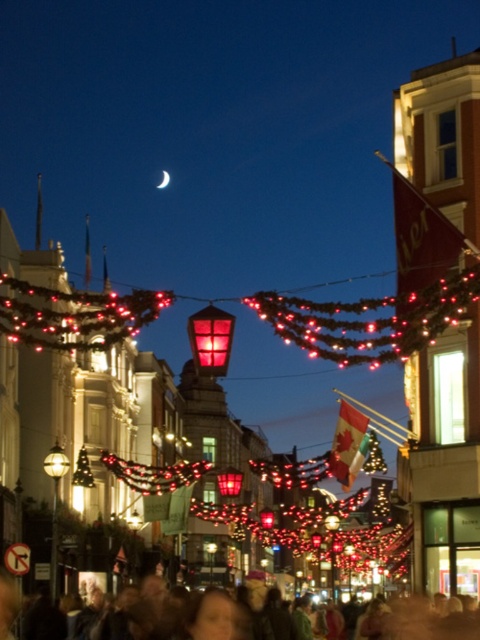
You are standing on the festive street and want to hang a new decorative item between the matte glass lantern at center and the matte red lantern at center. Based on their positions, which lantern should you place the item above to ensure it is closer to the lower one?

The matte glass lantern at center is positioned over the matte red lantern at center. To place the item closer to the lower one, you should hang it above the matte red lantern at center since it is below the glass lantern.

You are standing on the street and want to walk towards the two points marked in the scene. Which point, point (406, 340) or point (166, 177), will you reach first?

You will reach point (406, 340) first because it is closer to you than point (166, 177).

You are an event planner setting up decorations for a Canadian holiday event. You have a matte glass lantern at center and a silver metallic crescent moon at upper center. Which decoration is placed to the left of the other?

The silver metallic crescent moon at upper center is to the left of the matte glass lantern at center.